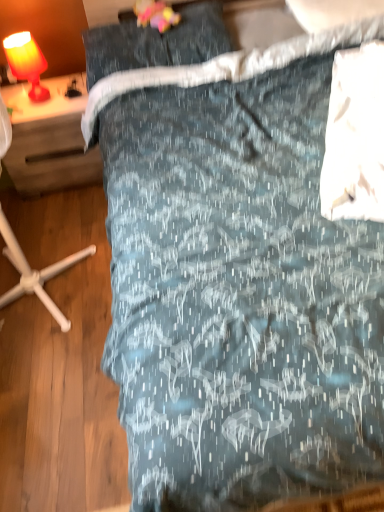
Question: From the image's perspective, is dark gray fabric pillow at upper center on matte wood desk at left?

Choices:
 (A) yes
 (B) no

Answer: (A)

Question: Is dark gray fabric pillow at upper center to the left of matte wood desk at left from the viewer's perspective?

Choices:
 (A) no
 (B) yes

Answer: (A)

Question: Can matte wood desk at left be found inside dark gray fabric pillow at upper center?

Choices:
 (A) no
 (B) yes

Answer: (A)

Question: Is there a large distance between dark gray fabric pillow at upper center and matte wood desk at left?

Choices:
 (A) no
 (B) yes

Answer: (A)

Question: From the image's perspective, would you say dark gray fabric pillow at upper center is shown under matte wood desk at left?

Choices:
 (A) yes
 (B) no

Answer: (B)

Question: Can you confirm if dark gray fabric pillow at upper center is bigger than matte wood desk at left?

Choices:
 (A) yes
 (B) no

Answer: (B)

Question: From a real-world perspective, is matte wood desk at left located higher than matte orange lamp at upper left?

Choices:
 (A) no
 (B) yes

Answer: (A)

Question: Is matte wood desk at left shorter than matte orange lamp at upper left?

Choices:
 (A) yes
 (B) no

Answer: (B)

Question: Does matte wood desk at left have a greater width compared to matte orange lamp at upper left?

Choices:
 (A) no
 (B) yes

Answer: (B)

Question: Is matte wood desk at left at the right side of matte orange lamp at upper left?

Choices:
 (A) yes
 (B) no

Answer: (A)

Question: From the image's perspective, does matte wood desk at left appear higher than matte orange lamp at upper left?

Choices:
 (A) yes
 (B) no

Answer: (B)

Question: Is matte wood desk at left to the left of matte orange lamp at upper left from the viewer's perspective?

Choices:
 (A) yes
 (B) no

Answer: (B)

Question: Is matte orange lamp at upper left oriented away from matte wood desk at left?

Choices:
 (A) yes
 (B) no

Answer: (B)